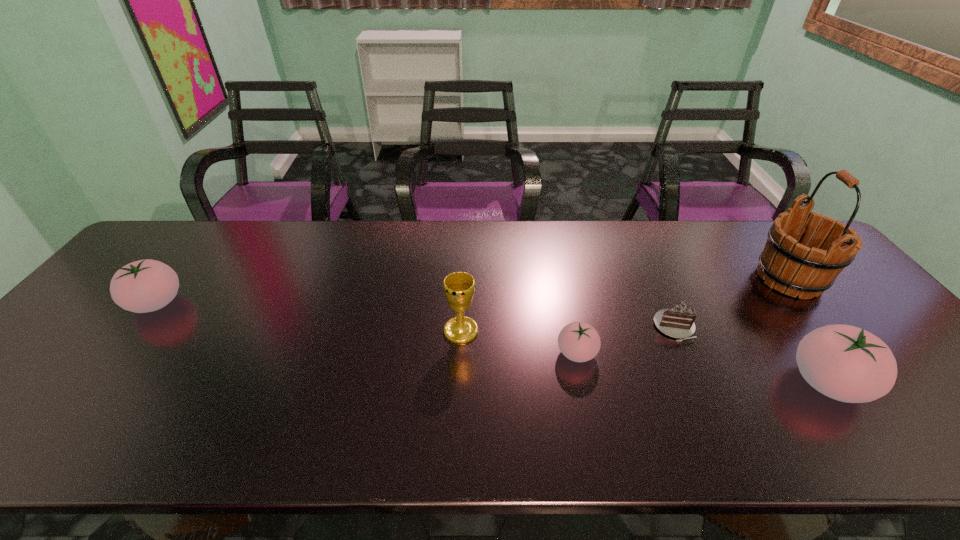
Locate an element on the screen. This screenshot has width=960, height=540. the farthest tomato is located at coordinates (147, 285).

Find the location of `the third shortest object`. the third shortest object is located at coordinates (147, 285).

Identify the location of the shortest tomato. (578, 341).

The height and width of the screenshot is (540, 960). What are the coordinates of `the second shortest object` in the screenshot? It's located at (578, 341).

Identify the location of the rightmost tomato. The image size is (960, 540). (846, 363).

Identify the location of wine bucket. This screenshot has height=540, width=960. [x=786, y=264].

This screenshot has width=960, height=540. Find the location of `chocolate cake`. chocolate cake is located at coordinates (678, 321).

This screenshot has height=540, width=960. What are the coordinates of `the shortest object` in the screenshot? It's located at (x=678, y=321).

Identify the location of the fifth object from right to left. This screenshot has width=960, height=540. (459, 287).

Locate an element on the screen. Image resolution: width=960 pixels, height=540 pixels. free location located on the back of the leftmost tomato is located at coordinates (212, 232).